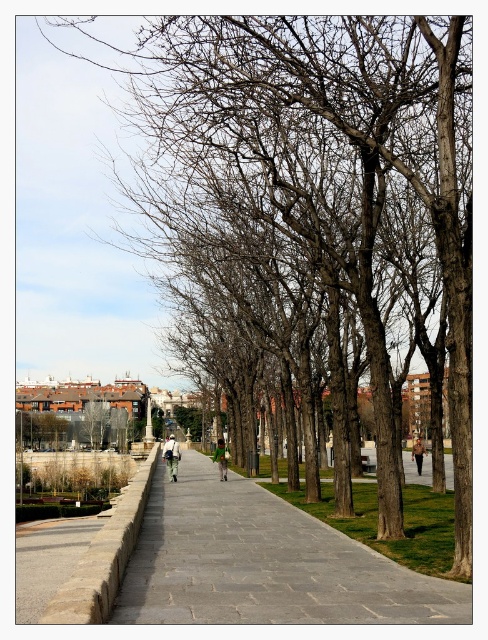
Based on the photo, you are standing at the entrance of the park and see the gray stone pavement at center. Can you estimate its location using coordinates?

The gray stone pavement at center is located at coordinates point (264, 563).

You are a park ranger who needs to retrieve both the green fabric backpack at center and the khaki cotton jacket at center. If you start at the pathway, which item would you reach first while walking straight ahead?

Both items are located at the center of the scene, so their positions are equidistant from the starting point on the pathway. Therefore, you would reach them at the same time.

You are a hiker who just arrived at the park and see the green fabric backpack at center and the khaki cotton jacket at center. You want to place both items on the ground next to the path. Since the ground is uneven, which item should you place first to ensure stability?

The green fabric backpack at center has a greater height compared to the khaki cotton jacket at center, so you should place the khaki cotton jacket at center first to ensure stability as it is shorter and less likely to tip over.